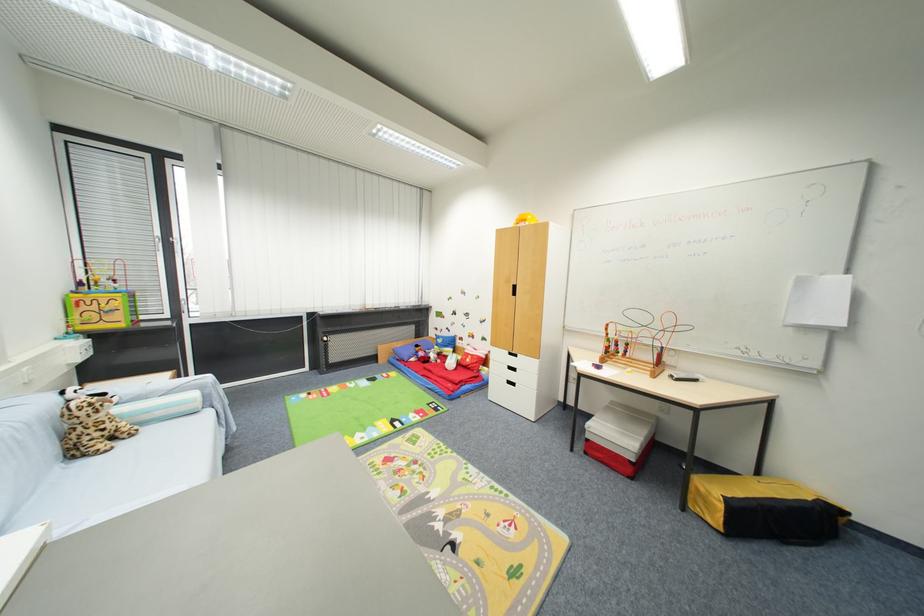
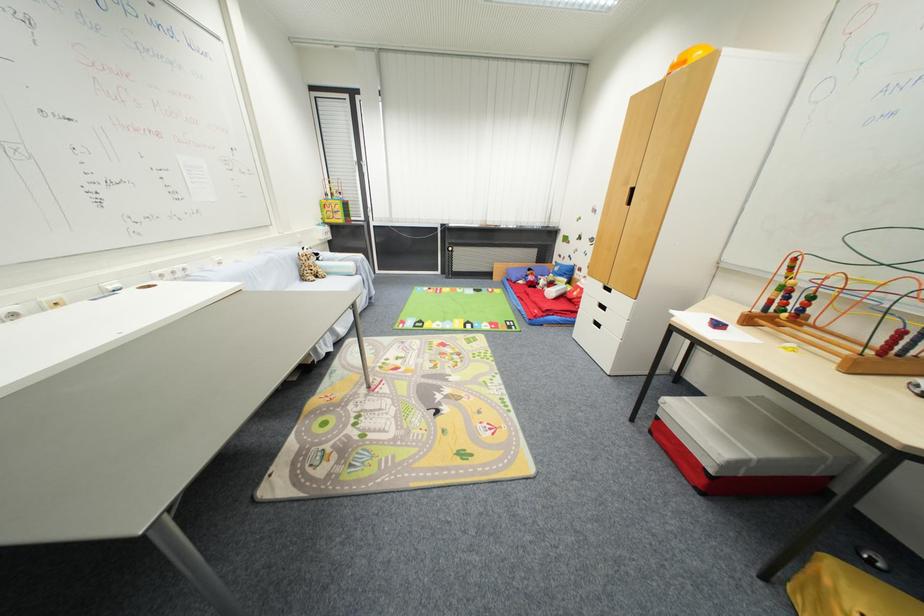
Where in the second image is the point corresponding to point 513,354 from the first image?

(606, 286)